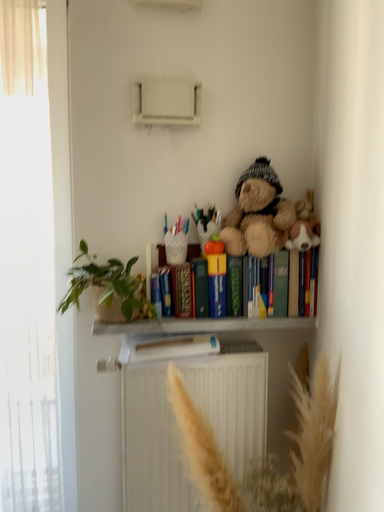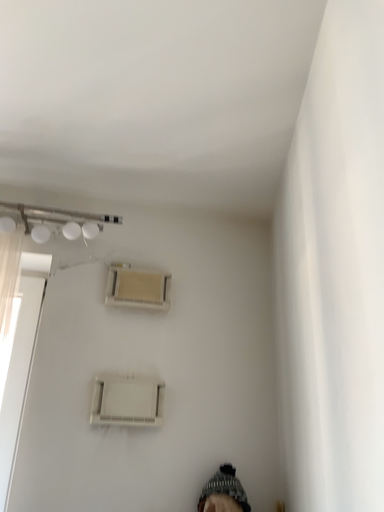
Question: How did the camera likely rotate when shooting the video?

Choices:
 (A) rotated upward
 (B) rotated downward

Answer: (A)